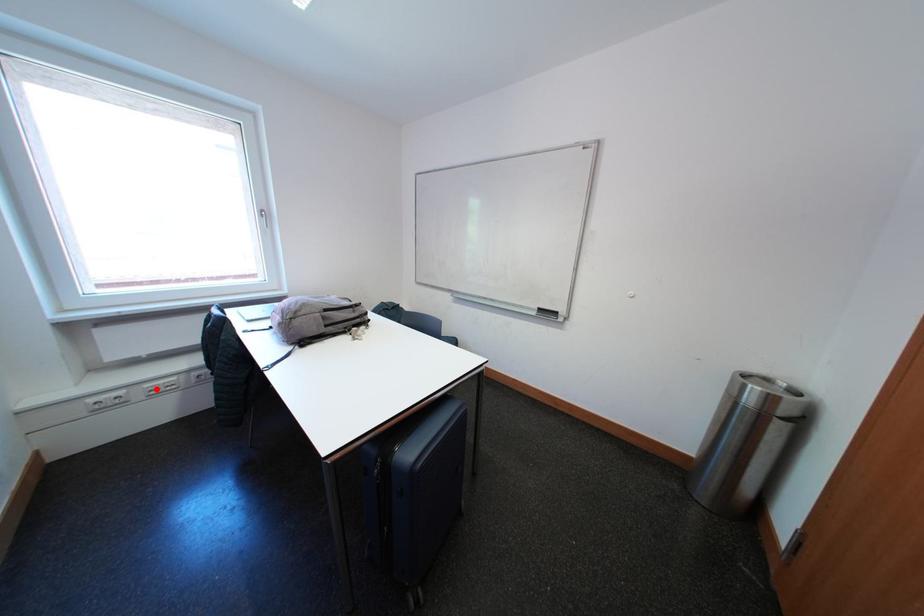
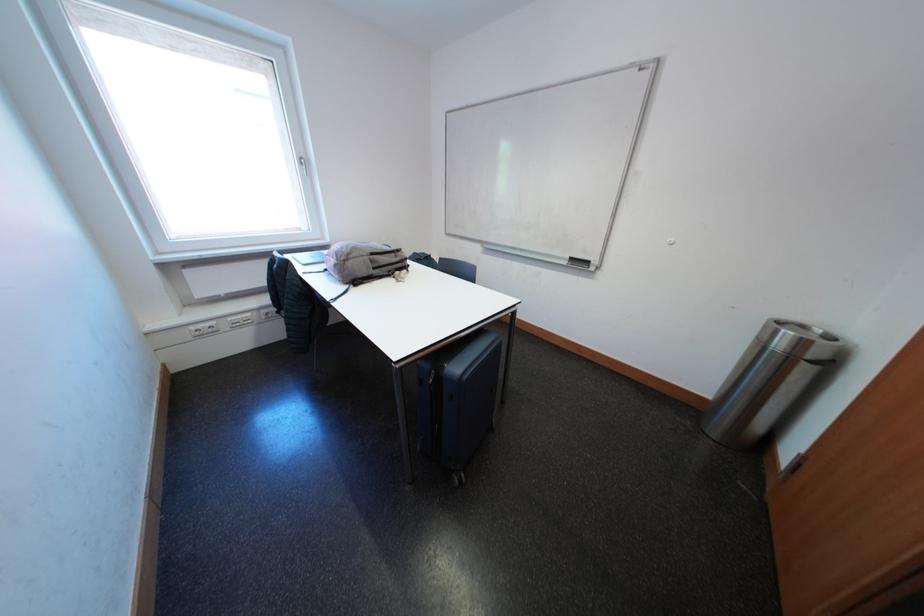
Question: I am providing you with two images of the same scene from different viewpoints. Image1 has a red point marked. In image2, the corresponding 3D location appears at what relative position? Reply with the corresponding letter.

Choices:
 (A) Closer
 (B) Farther

Answer: (A)